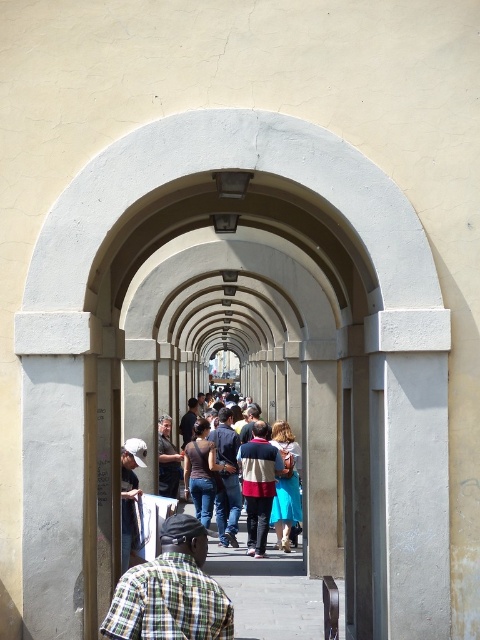
Question: Can you confirm if matte brown skirt at center is positioned to the left of dark blue jeans at center?

Choices:
 (A) yes
 (B) no

Answer: (B)

Question: Which point is farther to the camera?

Choices:
 (A) striped sweater at center
 (B) matte brown shirt at center
 (C) matte brown skirt at center
 (D) green plaid shirt at center

Answer: (B)

Question: Which of the following is the closest to the observer?

Choices:
 (A) (266, 488)
 (B) (117, 618)

Answer: (B)

Question: From the image, what is the correct spatial relationship of matte brown shirt at center in relation to denim jacket at center?

Choices:
 (A) left
 (B) right

Answer: (B)

Question: Which point appears farthest from the camera in this image?

Choices:
 (A) (253, 435)
 (B) (167, 624)
 (C) (170, 481)
 (D) (213, 504)

Answer: (C)

Question: Considering the relative positions of denim jeans at center and dark blue jeans at center in the image provided, where is denim jeans at center located with respect to dark blue jeans at center?

Choices:
 (A) below
 (B) above

Answer: (B)